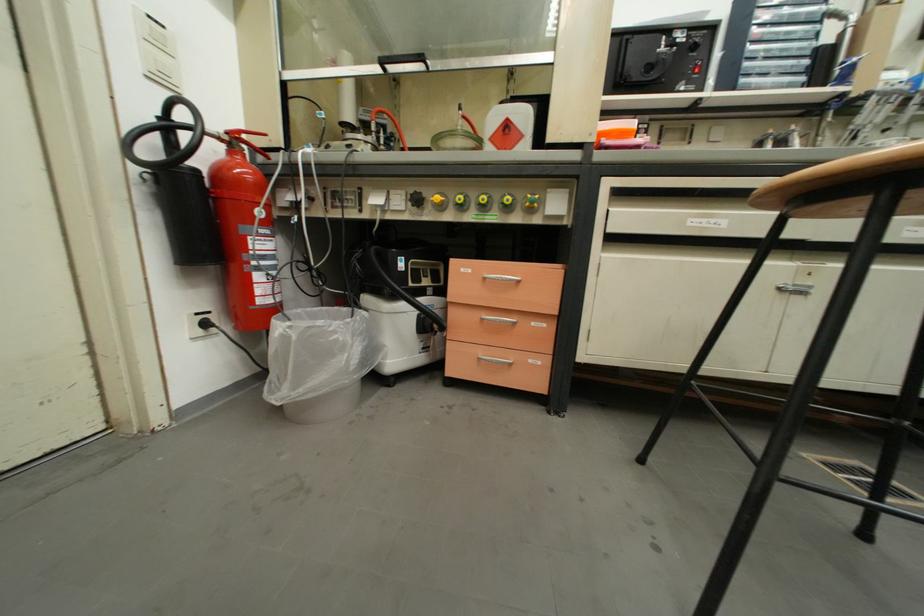
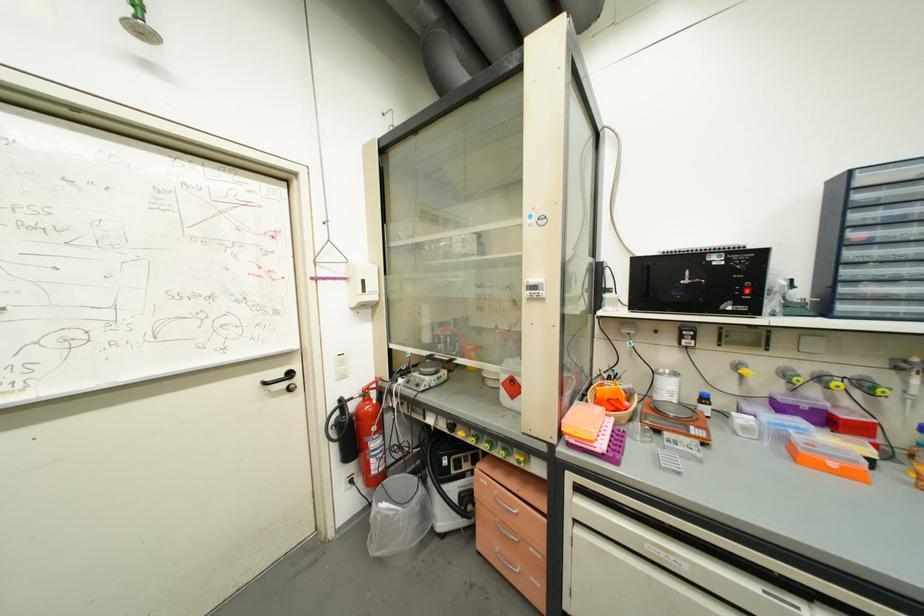
The point at (687, 91) is marked in the first image. Where is the corresponding point in the second image?

(735, 310)